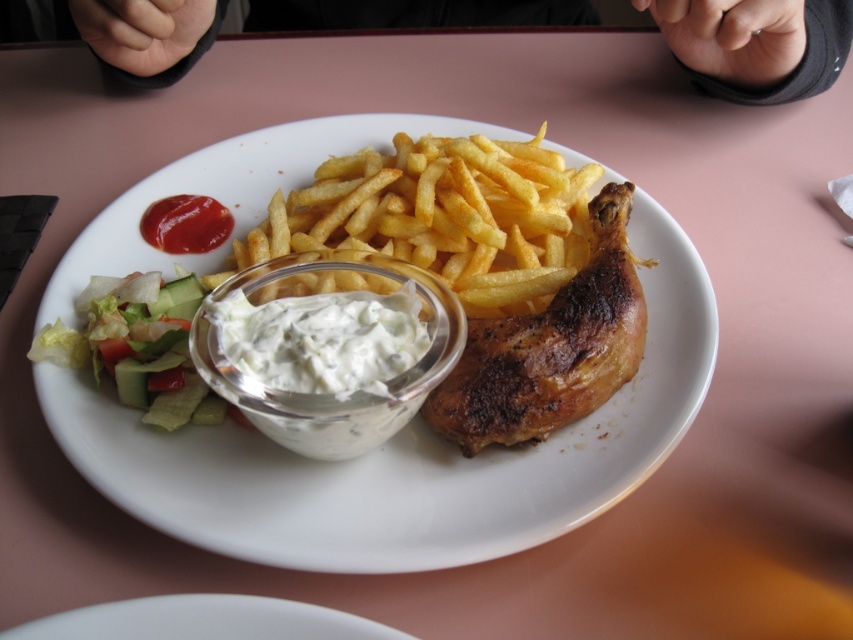
Who is taller, white matte plate at center or golden crispy french fries at center?

With more height is white matte plate at center.

Is white matte plate at center positioned at the back of golden crispy french fries at center?

No.

Find the location of a particular element. This screenshot has height=640, width=853. white matte plate at center is located at coordinates (407, 456).

Between point (227, 189) and point (596, 310), which one is positioned in front?

Point (596, 310) is more forward.

Is white matte plate at center to the left of brown crispy chicken leg at center from the viewer's perspective?

Indeed, white matte plate at center is positioned on the left side of brown crispy chicken leg at center.

Identify the location of white matte plate at center. The image size is (853, 640). (407, 456).

Looking at this image, measure the distance between point (242, 260) and camera.

The distance of point (242, 260) from camera is 22.98 inches.

Is golden crispy french fries at center above fresh green salad at left?

Yes, golden crispy french fries at center is above fresh green salad at left.

Measure the distance between point [471,289] and camera.

Point [471,289] is 20.71 inches away from camera.

The width and height of the screenshot is (853, 640). What are the coordinates of `golden crispy french fries at center` in the screenshot? It's located at (444, 214).